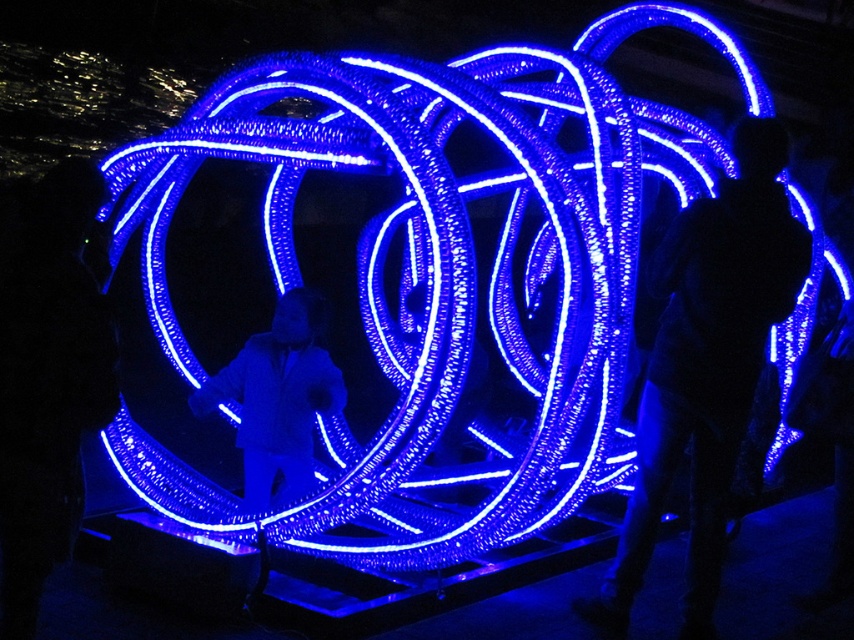
Based on the photo, you are an event photographer at the illuminated art installation. You want to capture a photo of the silhouette figure at right and the matte black suit at center. Based on their positions, which object is closer to the ground?

The silhouette figure at right is closer to the ground because it is positioned below the matte black suit at center.

You are an event planner trying to arrange a pathway for guests to walk through the illuminated art installation. You notice a silhouette figure at right and a matte black suit at center. Which object should you consider in terms of width to ensure guests can comfortably pass between them?

The silhouette figure at right might be wider than the matte black suit at center, so you should consider the silhouette figure at right when planning the pathway to ensure enough space for guests to pass comfortably.